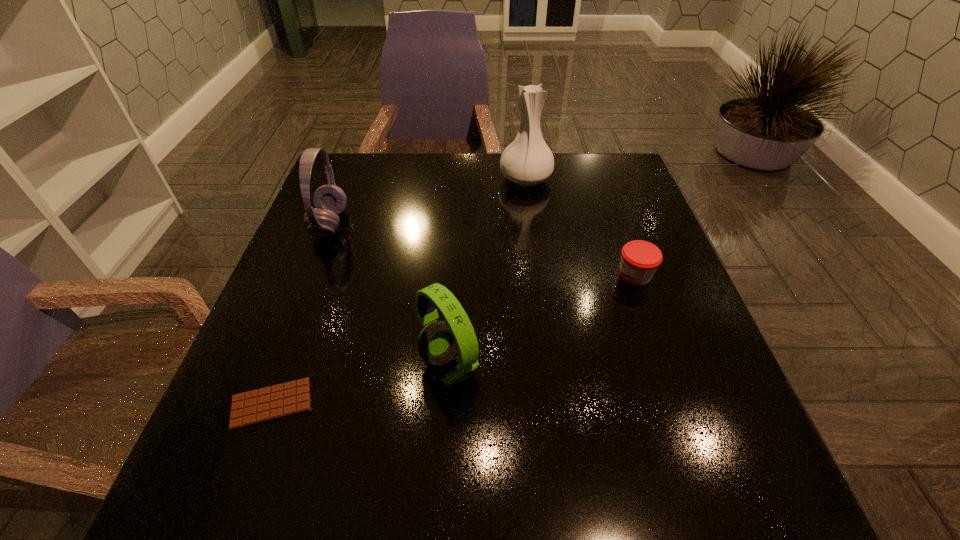
Locate an element on the screen. This screenshot has height=540, width=960. the farthest object is located at coordinates (527, 161).

The image size is (960, 540). I want to click on the fourth object from left to right, so click(527, 161).

At what (x,y) coordinates should I click in order to perform the action: click on the left headset. Please return your answer as a coordinate pair (x, y). The image size is (960, 540). Looking at the image, I should click on (329, 200).

Identify the location of the second farthest object. (329, 200).

The image size is (960, 540). I want to click on the nearer headset, so click(x=438, y=343).

Identify the location of the third object from right to left. Image resolution: width=960 pixels, height=540 pixels. (438, 343).

Where is `the rightmost object`? The width and height of the screenshot is (960, 540). the rightmost object is located at coordinates (640, 259).

At what (x,y) coordinates should I click in order to perform the action: click on the fourth tallest object. Please return your answer as a coordinate pair (x, y). The width and height of the screenshot is (960, 540). Looking at the image, I should click on (640, 259).

Image resolution: width=960 pixels, height=540 pixels. In order to click on candy bar in this screenshot , I will do `click(253, 407)`.

Find the location of a particular element. The height and width of the screenshot is (540, 960). free point located 0.110m on the left of the fourth object from left to right is located at coordinates (461, 179).